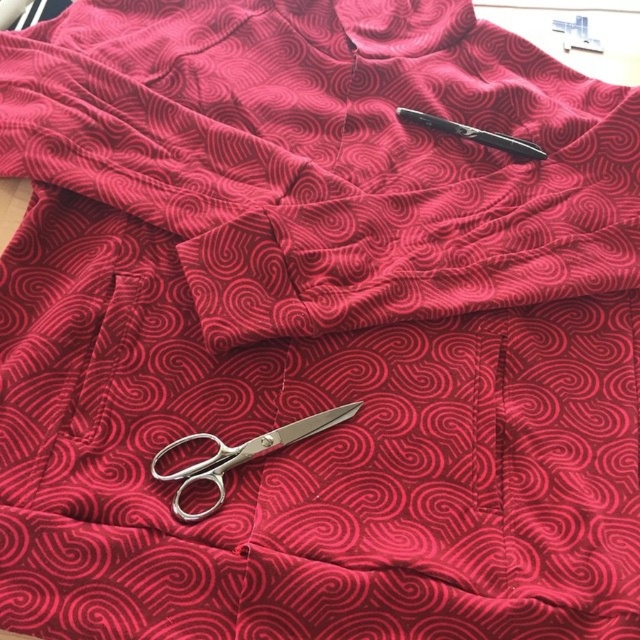
Question: Is polished silver scissors at center further to camera compared to metallic pen at upper center?

Choices:
 (A) yes
 (B) no

Answer: (B)

Question: Is polished silver scissors at center wider than metallic pen at upper center?

Choices:
 (A) no
 (B) yes

Answer: (B)

Question: Among these objects, which one is farthest from the camera?

Choices:
 (A) polished silver scissors at center
 (B) metallic pen at upper center

Answer: (B)

Question: Is polished silver scissors at center positioned in front of metallic pen at upper center?

Choices:
 (A) yes
 (B) no

Answer: (A)